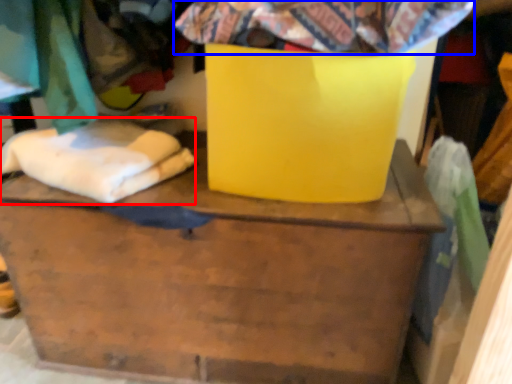
Question: Which point is closer to the camera, linen (highlighted by a red box) or fabric (highlighted by a blue box)?

Choices:
 (A) linen
 (B) fabric

Answer: (B)